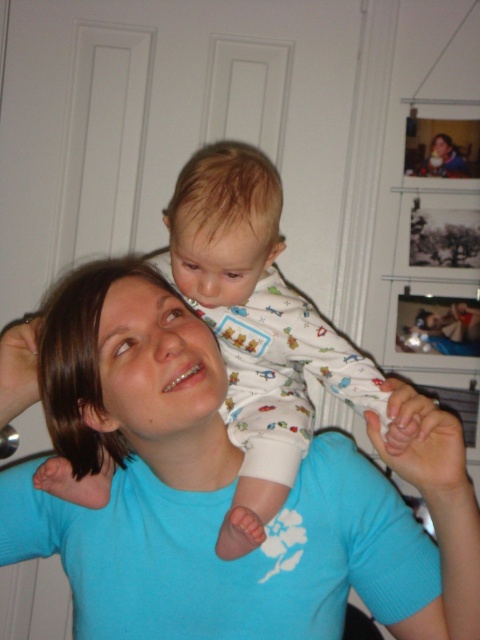
You are a photographer standing in the room where the scene is taking place. You want to take a photo of the blue cotton shirt at center with your camera. Can you reach the camera and the shirt at the same time without moving either?

The blue cotton shirt at center and camera are 68.83 centimeters apart from each other. Since the average human arm span is about 1.5 meters, you can easily reach both the camera and the shirt at the same time without moving either.

You are standing in the room where the adult and child are. You want to place a small decoration on the wall between the two points labeled point (x=178, y=316) and point (x=266, y=160). Which point should you place it closer to so that it appears larger to someone entering the room?

You should place the decoration closer to point (x=178, y=316) because it is closer to the viewer, making the decoration appear larger when viewed from the entrance.